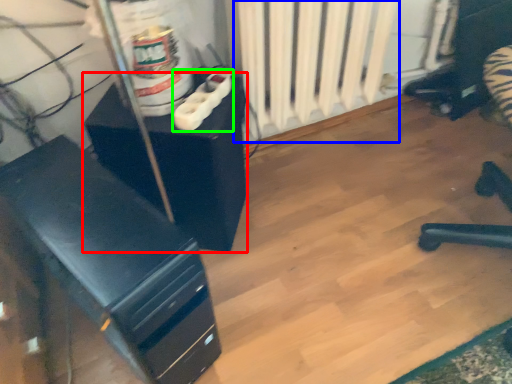
Question: Which object is positioned closest to furniture (highlighted by a red box)? Select from radiator (highlighted by a blue box) and plug (highlighted by a green box).

Choices:
 (A) radiator
 (B) plug

Answer: (B)